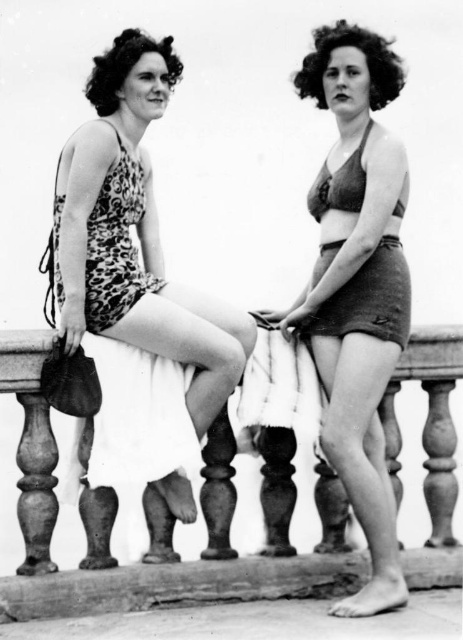
What is the position of the point labeled as point (356, 285) in the image?

The point labeled as point (356, 285) is located on the matte brown shorts at center.

You are a costume designer preparing for a historical play set in the 1920s. You need to ensure that the costume pieces for the character in the image match the proportions shown. Given the matte brown shorts at center and the matte brown bikini top at center, which piece of clothing has a greater width?

The matte brown shorts at center has a greater width than the matte brown bikini top at center, as stated in the description.

You are a photographer trying to capture a closeup shot of the leopard print swimsuit at left and the wooden balustrade at center. Given that your camera has a minimum focus distance of 15 feet, can you get both subjects in focus without moving the camera?

The leopard print swimsuit at left is 14.77 feet away from the wooden balustrade at center. Since the minimum focus distance is 15 feet, the camera cannot focus on both subjects as the distance between them is less than the required 15 feet.